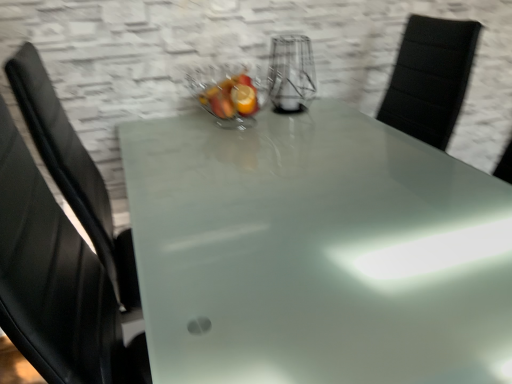
Find the location of `frosted glass table at center`. frosted glass table at center is located at coordinates (316, 252).

The width and height of the screenshot is (512, 384). Find the location of `clear glass bowl at center`. clear glass bowl at center is located at coordinates (226, 94).

The width and height of the screenshot is (512, 384). I want to click on frosted glass table at center, so click(316, 252).

From the image's perspective, which object appears higher, frosted glass table at center or clear glass bowl at center?

clear glass bowl at center appears higher in the image.

Is clear glass bowl at center at the back of frosted glass table at center?

No.

Looking at this image, considering the relative sizes of frosted glass table at center and clear glass bowl at center in the image provided, is frosted glass table at center bigger than clear glass bowl at center?

Correct, frosted glass table at center is larger in size than clear glass bowl at center.

Does point (256, 273) come in front of point (229, 122)?

Yes, point (256, 273) is closer to viewer.

Which of these two, clear glass bowl at center or clear glass vase at center, is thinner?

Thinner between the two is clear glass vase at center.

Is clear glass bowl at center in contact with clear glass vase at center?

No, clear glass bowl at center is not beside clear glass vase at center.

Who is shorter, clear glass bowl at center or clear glass vase at center?

Standing shorter between the two is clear glass bowl at center.

Based on the photo, is clear glass bowl at center aimed at clear glass vase at center?

No, clear glass bowl at center does not turn towards clear glass vase at center.

Is clear glass vase at center inside frosted glass table at center?

Definitely not — clear glass vase at center is not inside frosted glass table at center.

How far apart are frosted glass table at center and clear glass vase at center?

frosted glass table at center and clear glass vase at center are 60.11 centimeters apart.

Is frosted glass table at center taller or shorter than clear glass vase at center?

frosted glass table at center is taller than clear glass vase at center.

Considering the sizes of objects frosted glass table at center and clear glass vase at center in the image provided, who is bigger, frosted glass table at center or clear glass vase at center?

With larger size is frosted glass table at center.

Which object is positioned more to the right, clear glass vase at center or frosted glass table at center?

frosted glass table at center is more to the right.

From a real-world perspective, is clear glass vase at center under frosted glass table at center?

Incorrect, from a real-world perspective, clear glass vase at center is higher than frosted glass table at center.

Considering the sizes of objects clear glass vase at center and frosted glass table at center in the image provided, who is wider, clear glass vase at center or frosted glass table at center?

frosted glass table at center.

Can you confirm if clear glass vase at center is taller than frosted glass table at center?

In fact, clear glass vase at center may be shorter than frosted glass table at center.

Is point (221, 82) closer to viewer compared to point (191, 139)?

No.

Based on the photo, which is correct: clear glass bowl at center is inside frosted glass table at center, or outside of it?

The correct answer is: outside.

Is clear glass bowl at center placed right next to frosted glass table at center?

No, clear glass bowl at center is not beside frosted glass table at center.

In terms of height, does clear glass bowl at center look taller or shorter compared to frosted glass table at center?

Considering their sizes, clear glass bowl at center has less height than frosted glass table at center.

Locate an element on the screen. glass bowl below the clear glass vase at center (from the image's perspective) is located at coordinates (226, 94).

Is clear glass vase at center completely or partially outside of clear glass bowl at center?

clear glass vase at center lies outside clear glass bowl at center's area.

Who is more distant, clear glass vase at center or clear glass bowl at center?

clear glass vase at center is more distant.

Is clear glass vase at center oriented away from clear glass bowl at center?

No, clear glass vase at center's orientation is not away from clear glass bowl at center.

Locate an element on the screen. glass bowl on the left of the frosted glass table at center is located at coordinates (226, 94).

At what (x,y) coordinates should I click in order to perform the action: click on glass bowl in front of the clear glass vase at center. Please return your answer as a coordinate pair (x, y). Looking at the image, I should click on (226, 94).

Based on their spatial positions, is clear glass vase at center or clear glass bowl at center further from frosted glass table at center?

clear glass vase at center.

When comparing their distances from clear glass bowl at center, does frosted glass table at center or clear glass vase at center seem further?

frosted glass table at center is positioned further to the anchor clear glass bowl at center.

When comparing their distances from frosted glass table at center, does clear glass bowl at center or clear glass vase at center seem closer?

clear glass bowl at center lies closer to frosted glass table at center than the other object.

When comparing their distances from clear glass vase at center, does clear glass bowl at center or frosted glass table at center seem closer?

Based on the image, clear glass bowl at center appears to be nearer to clear glass vase at center.

When comparing their distances from clear glass vase at center, does frosted glass table at center or clear glass bowl at center seem further?

Based on the image, frosted glass table at center appears to be further to clear glass vase at center.

When comparing their distances from clear glass bowl at center, does clear glass vase at center or frosted glass table at center seem closer?

Based on the image, clear glass vase at center appears to be nearer to clear glass bowl at center.

I want to click on glass bowl between frosted glass table at center and clear glass vase at center along the z-axis, so click(x=226, y=94).